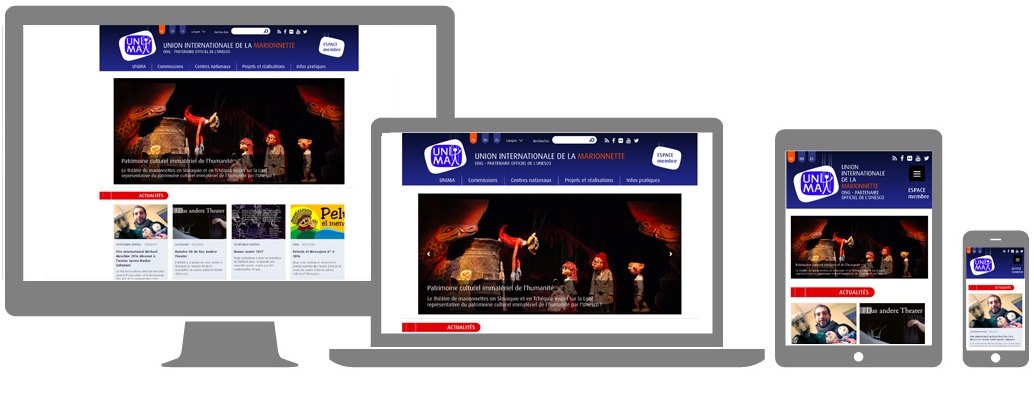
You are a GUI agent. You are given a task and a screenshot of the screen. Output one action in this format:
    pyautogui.click(x=<x>, y=<y>)
    Task: Click on the monitor base
    
    Given the screenshot: What is the action you would take?
    pyautogui.click(x=221, y=352)